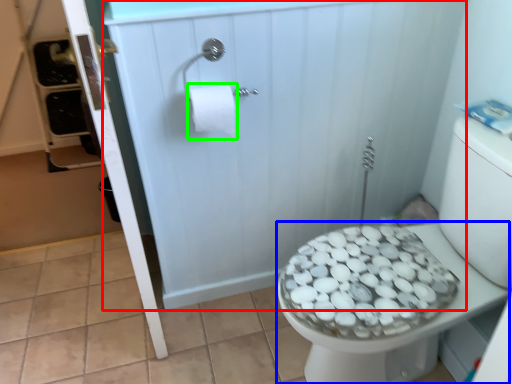
Question: Which object is positioned closest to screen door (highlighted by a red box)? Select from bidet (highlighted by a blue box) and toilet paper (highlighted by a green box).

Choices:
 (A) bidet
 (B) toilet paper

Answer: (B)